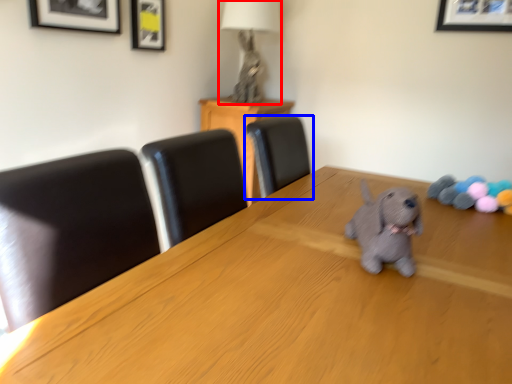
Question: Among these objects, which one is nearest to the camera, table lamp (highlighted by a red box) or chair (highlighted by a blue box)?

Choices:
 (A) table lamp
 (B) chair

Answer: (B)